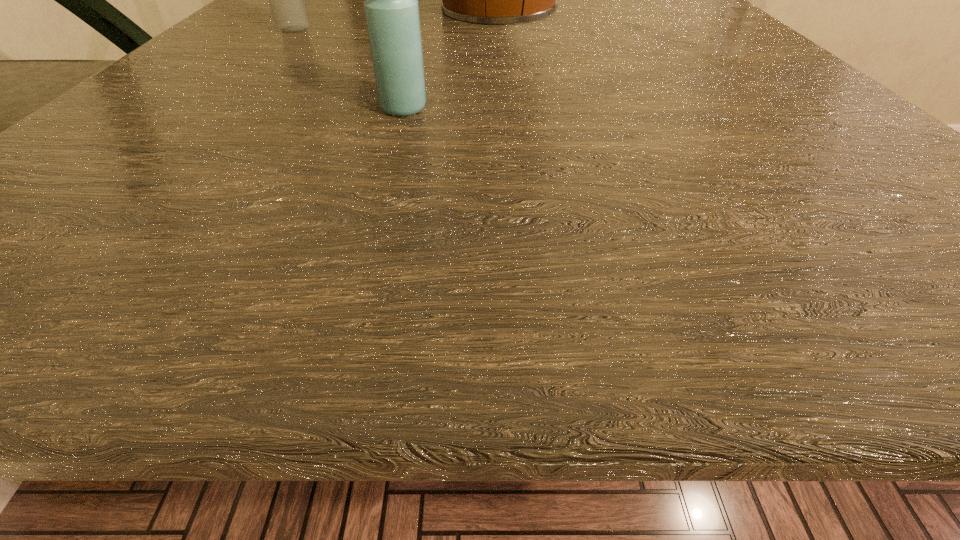
You are a GUI agent. You are given a task and a screenshot of the screen. Output one action in this format:
    pyautogui.click(x=<x>, y=<y>)
    Task: Click on the unoccupied area between the rightmost water bottle and the second water bottle from left to right
    Image resolution: width=960 pixels, height=540 pixels.
    Given the screenshot: What is the action you would take?
    pyautogui.click(x=565, y=83)

I want to click on empty location between the tallest water bottle and the rightmost object, so click(x=511, y=44).

You are a GUI agent. You are given a task and a screenshot of the screen. Output one action in this format:
    pyautogui.click(x=<x>, y=<y>)
    Task: Click on the third closest object to the leftmost water bottle
    
    Given the screenshot: What is the action you would take?
    pyautogui.click(x=747, y=0)

Point out which object is positioned as the second nearest to the second nearest object. Please provide its 2D coordinates. Your answer should be formatted as a tuple, i.e. [(x, y)], where the tuple contains the x and y coordinates of a point satisfying the conditions above.

[(391, 7)]

Select which water bottle appears as the second closest to the rightmost water bottle. Please provide its 2D coordinates. Your answer should be formatted as a tuple, i.e. [(x, y)], where the tuple contains the x and y coordinates of a point satisfying the conditions above.

[(286, 0)]

I want to click on water bottle that is the second closest to the second water bottle from right to left, so click(x=747, y=0).

This screenshot has width=960, height=540. Find the location of `vacant space that satisfies the following two spatial constraints: 1. on the back side of the nearest water bottle; 2. on the left side of the rightmost water bottle`. vacant space that satisfies the following two spatial constraints: 1. on the back side of the nearest water bottle; 2. on the left side of the rightmost water bottle is located at coordinates (418, 58).

This screenshot has height=540, width=960. What are the coordinates of `free location that satisfies the following two spatial constraints: 1. on the back side of the third farthest object; 2. on the right side of the nearest object` in the screenshot? It's located at (418, 58).